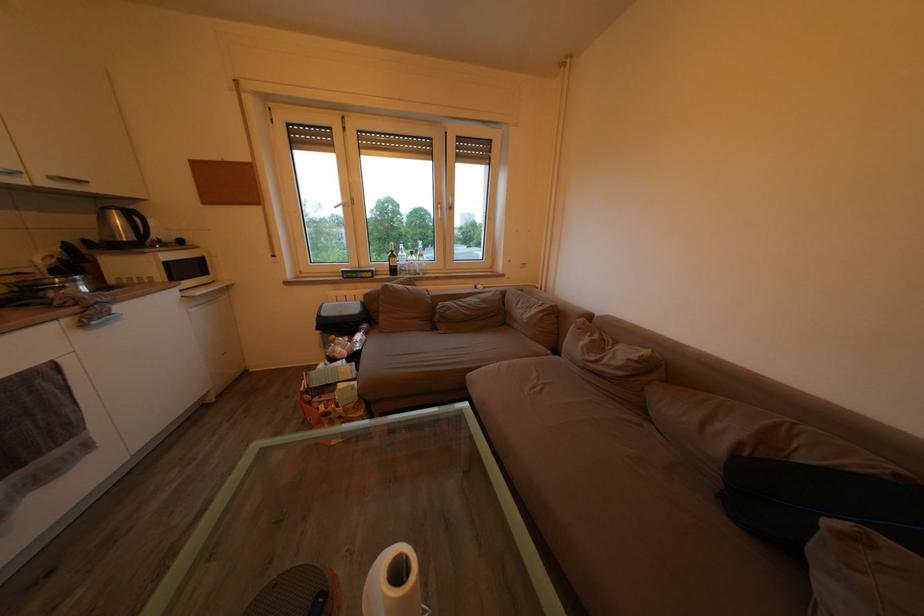
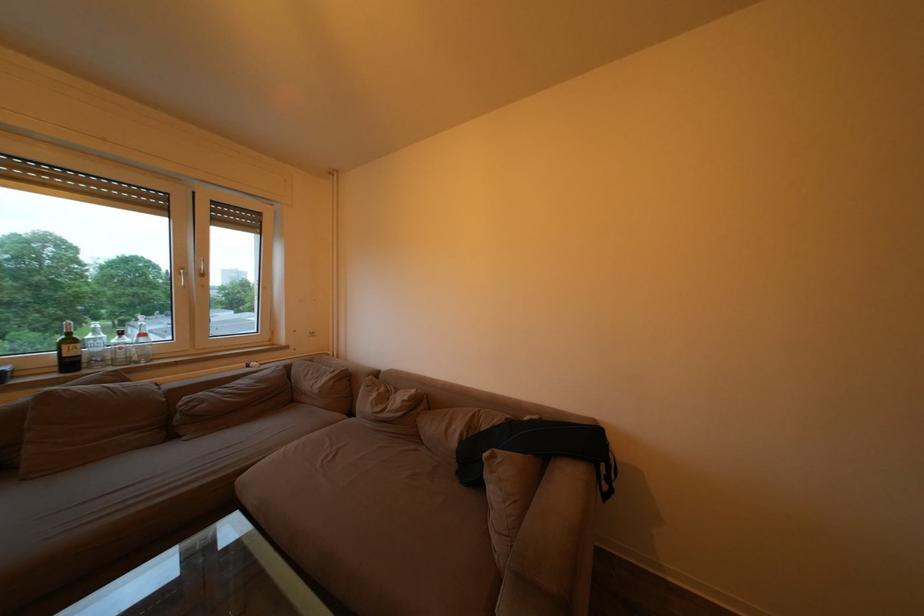
Locate, in the second image, the point that corresponds to pixel 400 262 in the first image.

(79, 347)